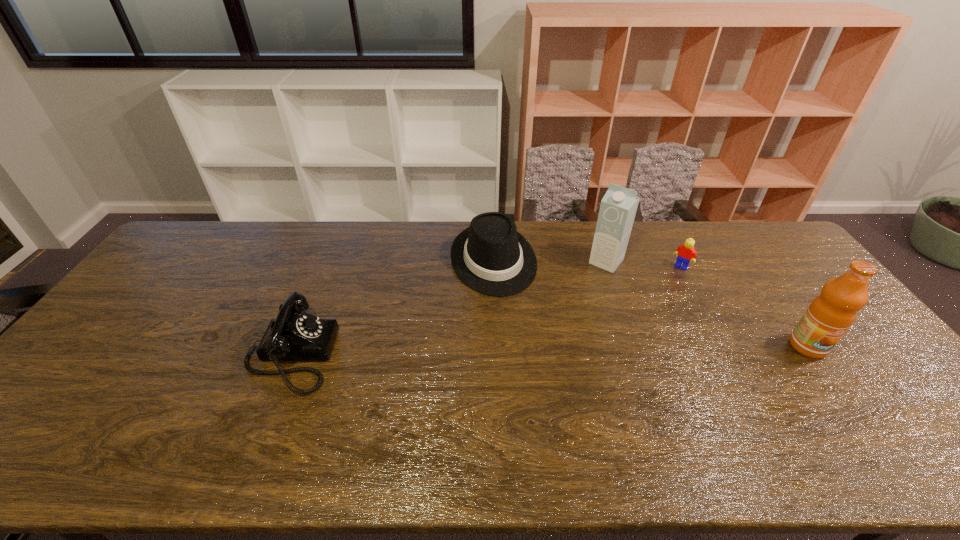
Locate an element on the screen. the leftmost object is located at coordinates (294, 335).

Where is `the rightmost object`? the rightmost object is located at coordinates (828, 317).

Identify the location of fedora. coord(490,256).

I want to click on the fourth object from left to right, so click(x=686, y=253).

I want to click on Lego, so click(686, 253).

Where is `carton`? carton is located at coordinates (618, 207).

This screenshot has width=960, height=540. In order to click on vacant position located 0.280m on the dial of the telephone in this screenshot , I will do `click(438, 354)`.

Identify the location of vacant space located on the label side of the fruit juice. The width and height of the screenshot is (960, 540). (849, 403).

Identify the location of blank area located on the front-facing side of the fourth object from right to left. coord(519,338).

At what (x,y) coordinates should I click in order to perform the action: click on vacant space located 0.260m on the front-facing side of the fourth object from right to left. Please return your answer as a coordinate pair (x, y). This screenshot has width=960, height=540. Looking at the image, I should click on (529, 363).